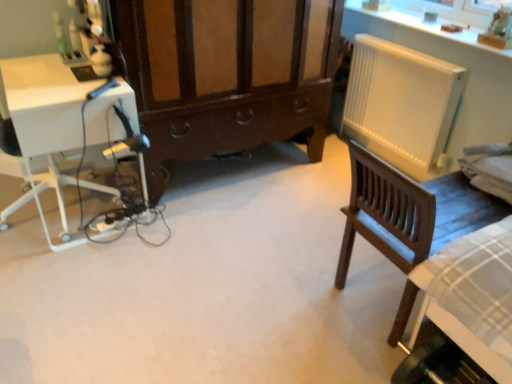
The image size is (512, 384). Identify the location of free area below brown wood cabinet at center (from a real-world perspective). (224, 172).